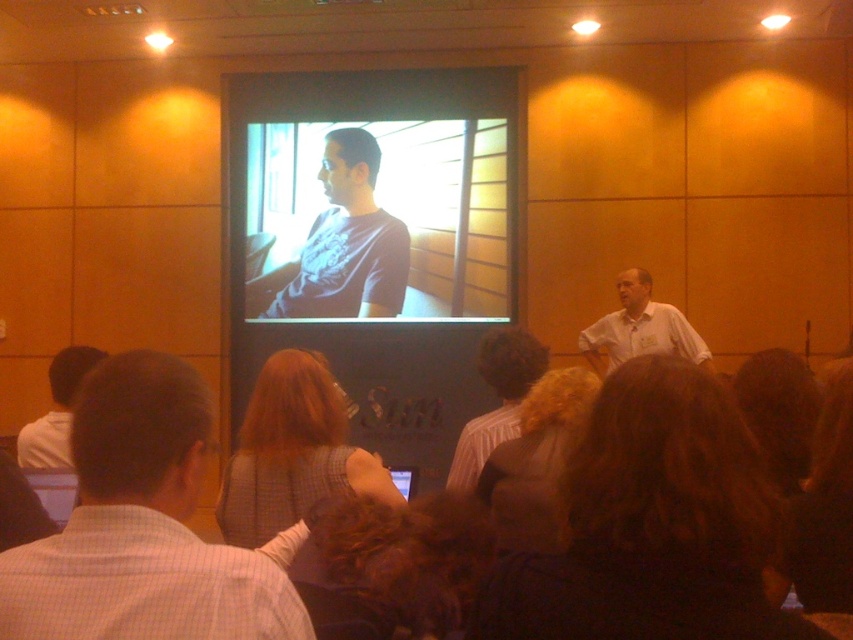
You are organizing a photo shoot and need to arrange two models wearing the striped shirt at center and white shirt at center. Based on their heights, which model should stand in front to ensure both are visible in the photo?

The striped shirt at center is shorter than white shirt at center, so the striped shirt at center should stand in front to ensure both are visible.

You are an attendee in the presentation. You notice a point marked at coordinates [293,451]. What object does this point correspond to?

The point at coordinates [293,451] corresponds to the plaid fabric sleeve at center.

You are an attendee at the presentation and want to locate the striped shirt at center. Where should you look?

The striped shirt at center is located at point 0.622 on the x axis and 0.586 on the y axis.